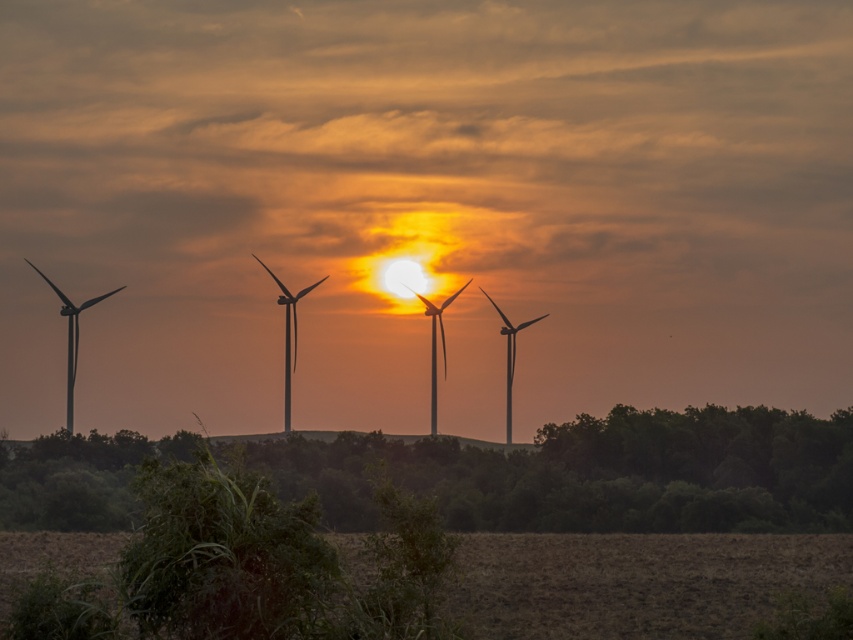
You are a drone operator tasked with capturing aerial footage of the sunset scene. Your drone is currently at the coordinates of the metallic gray windmill at center. You need to fly it to the exact center of the image to get the best shot. Is the windmill at the exact center of the image?

The metallic gray windmill at center is located at point (288, 333), which is slightly offset from the true center coordinates of (426, 320). Therefore, it is not exactly at the center of the image.

You are standing in the field in front of the wind turbines. You see a point marked at coordinates point (x=288, y=333). Which object is this point located on?

The point (x=288, y=333) is located on the metallic gray windmill at center.